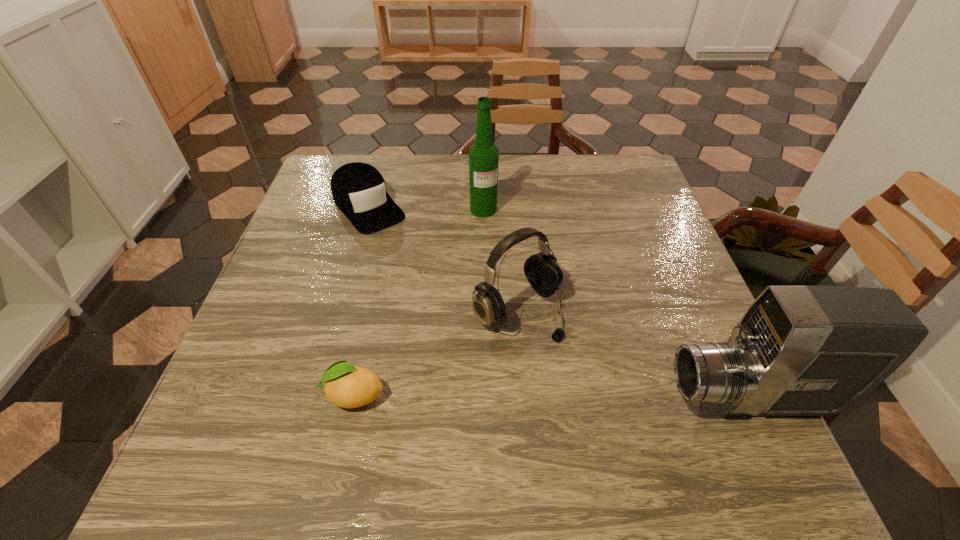
Locate an element on the screen. This screenshot has height=540, width=960. the shortest object is located at coordinates (347, 386).

Find the location of a particular element. This screenshot has height=540, width=960. the rightmost object is located at coordinates (798, 350).

Locate an element on the screen. the fourth shortest object is located at coordinates (798, 350).

The width and height of the screenshot is (960, 540). Identify the location of beer bottle. (483, 155).

The height and width of the screenshot is (540, 960). What are the coordinates of `the fourth tallest object` in the screenshot? It's located at (358, 189).

Image resolution: width=960 pixels, height=540 pixels. I want to click on the third tallest object, so click(x=542, y=270).

Image resolution: width=960 pixels, height=540 pixels. I want to click on headset, so click(542, 270).

Find the location of a particular element. The height and width of the screenshot is (540, 960). blank space located with leaves positioned above the shortest object is located at coordinates (221, 394).

Where is `blank space located 0.180m with leaves positioned above the shortest object`? blank space located 0.180m with leaves positioned above the shortest object is located at coordinates (221, 394).

I want to click on vacant space located at the front of the rightmost object, highlighting the lens, so click(536, 399).